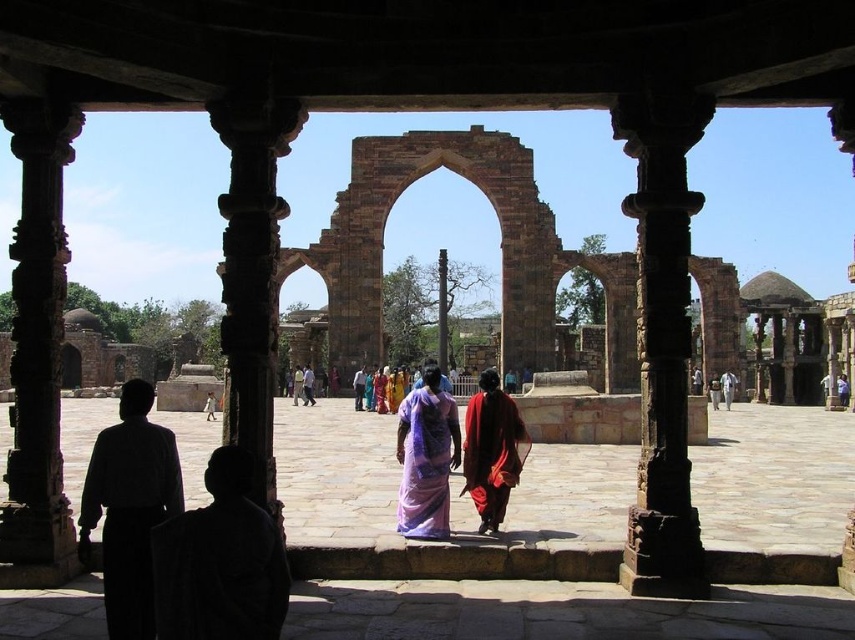
Question: Is brown stone pillar at center smaller than dark gray fabric robe at lower left?

Choices:
 (A) no
 (B) yes

Answer: (A)

Question: Is dark gray fabric robe at lower left behind matte purple sari at center?

Choices:
 (A) no
 (B) yes

Answer: (A)

Question: Estimate the real-world distances between objects in this image. Which object is farther from the dark gray fabric robe at lower left?

Choices:
 (A) red silk robe at center
 (B) brown stone pillar at center
 (C) white cotton dress at center

Answer: (C)

Question: Is silhouette robe at left to the left of white cotton dress at center from the viewer's perspective?

Choices:
 (A) no
 (B) yes

Answer: (A)

Question: Which point is closer to the camera?

Choices:
 (A) (641, 273)
 (B) (134, 420)
 (C) (439, 417)

Answer: (B)

Question: Which point is farther from the camera taking this photo?

Choices:
 (A) (730, 376)
 (B) (659, 156)
 (C) (207, 419)
 (D) (116, 518)

Answer: (A)